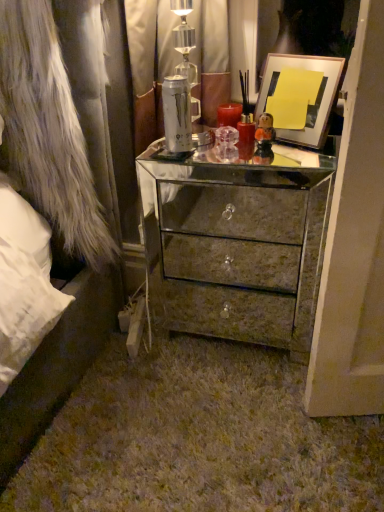
Where is `white fur coat at left`? This screenshot has height=512, width=384. white fur coat at left is located at coordinates (x=48, y=132).

Describe the element at coordinates (243, 244) in the screenshot. This screenshot has width=384, height=512. I see `mirrored metallic chest of drawers at center` at that location.

In order to click on white fur coat at left in this screenshot , I will do [48, 132].

From a real-world perspective, relative to mirrored metallic chest of drawers at center, is white fur coat at left vertically above or below?

From a real-world perspective, white fur coat at left is physically above mirrored metallic chest of drawers at center.

Considering the positions of point (40, 179) and point (206, 260), is point (40, 179) closer or farther from the camera than point (206, 260)?

Point (40, 179).

From the image's perspective, which is above, white fur coat at left or mirrored metallic chest of drawers at center?

white fur coat at left, from the image's perspective.

In the image, there is a white fur coat at left. At what (x,y) coordinates should I click in order to perform the action: click on the chest of drawers below it (from a real-world perspective). Please return your answer as a coordinate pair (x, y). Image resolution: width=384 pixels, height=512 pixels. Looking at the image, I should click on [x=243, y=244].

Considering their positions, is mirrored metallic chest of drawers at center located in front of or behind white fur coat at left?

mirrored metallic chest of drawers at center is positioned farther from the viewer than white fur coat at left.

Between mirrored metallic chest of drawers at center and white fur coat at left, which one has larger width?

white fur coat at left is wider.

How different are the orientations of mirrored metallic chest of drawers at center and white fur coat at left in degrees?

1.11 degrees.

Consider the image. Would you say metallic silver picture frame at upper right contains mirrored metallic chest of drawers at center?

No.

At what (x,y) coordinates should I click in order to perform the action: click on the chest of drawers in front of the metallic silver picture frame at upper right. Please return your answer as a coordinate pair (x, y). Image resolution: width=384 pixels, height=512 pixels. Looking at the image, I should click on (243, 244).

Is point (291, 71) farther from viewer compared to point (205, 298)?

No, it is in front of (205, 298).

In the scene shown: Which object is thinner, metallic silver picture frame at upper right or mirrored metallic chest of drawers at center?

metallic silver picture frame at upper right is thinner.

Is mirrored metallic chest of drawers at center at the right side of metallic silver picture frame at upper right?

No, mirrored metallic chest of drawers at center is not to the right of metallic silver picture frame at upper right.

Relative to metallic silver picture frame at upper right, is mirrored metallic chest of drawers at center in front or behind?

In the image, mirrored metallic chest of drawers at center appears in front of metallic silver picture frame at upper right.

Does point (219, 183) appear closer or farther from the camera than point (274, 75)?

Point (219, 183) is positioned closer to the camera compared to point (274, 75).

From the image's perspective, is mirrored metallic chest of drawers at center beneath metallic silver picture frame at upper right?

Yes, from the image's perspective, mirrored metallic chest of drawers at center is below metallic silver picture frame at upper right.

Considering the relative positions of white fur coat at left and metallic silver picture frame at upper right in the image provided, is white fur coat at left to the right of metallic silver picture frame at upper right from the viewer's perspective?

No.

Is white fur coat at left inside the boundaries of metallic silver picture frame at upper right, or outside?

white fur coat at left is not inside metallic silver picture frame at upper right, it's outside.

Is white fur coat at left not near metallic silver picture frame at upper right?

white fur coat at left is near metallic silver picture frame at upper right, not far away.

Is white fur coat at left in front of or behind metallic silver picture frame at upper right in the image?

Clearly, white fur coat at left is in front of metallic silver picture frame at upper right.

From the picture: Is metallic silver picture frame at upper right taller than white fur coat at left?

No, metallic silver picture frame at upper right is not taller than white fur coat at left.

From a real-world perspective, which object stands above the other?

metallic silver picture frame at upper right.

Considering the sizes of objects metallic silver picture frame at upper right and white fur coat at left in the image provided, who is smaller, metallic silver picture frame at upper right or white fur coat at left?

Smaller between the two is metallic silver picture frame at upper right.

Identify the location of chest of drawers located on the right of white fur coat at left. This screenshot has height=512, width=384. (243, 244).

What are the coordinates of `fur coat on the left of mirrored metallic chest of drawers at center` in the screenshot? It's located at (48, 132).

Which object lies nearer to the anchor point white fur coat at left, mirrored metallic chest of drawers at center or metallic silver picture frame at upper right?

mirrored metallic chest of drawers at center.

Which object lies further to the anchor point metallic silver picture frame at upper right, mirrored metallic chest of drawers at center or white fur coat at left?

white fur coat at left is positioned further to the anchor metallic silver picture frame at upper right.

Based on their spatial positions, is metallic silver picture frame at upper right or white fur coat at left further from mirrored metallic chest of drawers at center?

The object further to mirrored metallic chest of drawers at center is white fur coat at left.

When comparing their distances from metallic silver picture frame at upper right, does white fur coat at left or mirrored metallic chest of drawers at center seem further?

white fur coat at left is positioned further to the anchor metallic silver picture frame at upper right.

Estimate the real-world distances between objects in this image. Which object is closer to mirrored metallic chest of drawers at center, white fur coat at left or metallic silver picture frame at upper right?

metallic silver picture frame at upper right is positioned closer to the anchor mirrored metallic chest of drawers at center.

Which object lies nearer to the anchor point white fur coat at left, metallic silver picture frame at upper right or mirrored metallic chest of drawers at center?

Based on the image, mirrored metallic chest of drawers at center appears to be nearer to white fur coat at left.

Find the location of a particular element. This screenshot has height=512, width=384. chest of drawers between white fur coat at left and metallic silver picture frame at upper right in the horizontal direction is located at coordinates (243, 244).